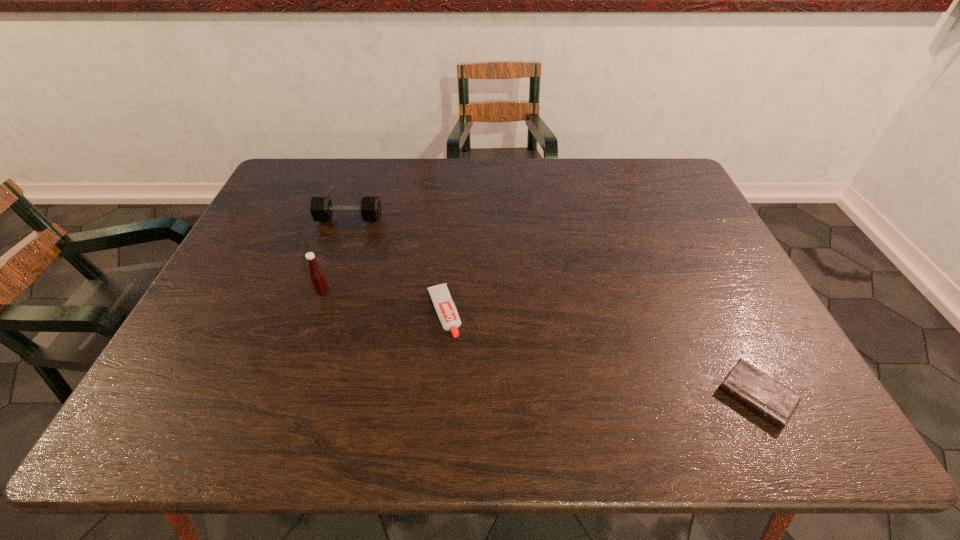
You are a GUI agent. You are given a task and a screenshot of the screen. Output one action in this format:
    pyautogui.click(x=<x>, y=<y>)
    Task: Click on the tallest object
    
    Given the screenshot: What is the action you would take?
    pyautogui.click(x=317, y=277)

This screenshot has width=960, height=540. Identify the location of the third shortest object. (321, 208).

I want to click on the farthest object, so click(x=321, y=208).

Identify the location of the second shortest object. This screenshot has height=540, width=960. (445, 308).

Locate an element on the screen. toothpaste is located at coordinates (445, 308).

Locate an element on the screen. the shortest object is located at coordinates (776, 403).

Where is `diary`? The width and height of the screenshot is (960, 540). diary is located at coordinates (776, 403).

What are the coordinates of `blank space located on the left of the tallest object` in the screenshot? It's located at (288, 291).

The width and height of the screenshot is (960, 540). What are the coordinates of `vacant space located 0.060m on the right of the third shortest object` in the screenshot? It's located at (401, 220).

Find the location of `vacant space located on the back of the toothpaste`. vacant space located on the back of the toothpaste is located at coordinates (452, 205).